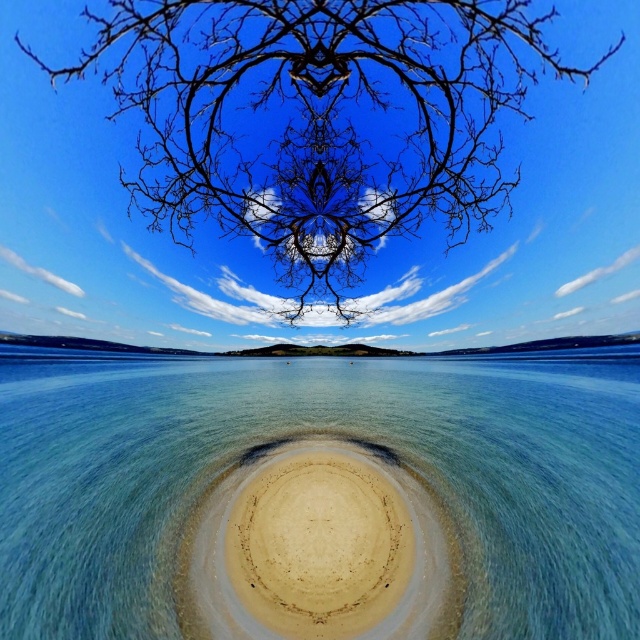
You are a bird trying to land on either the black matte tree at upper center or the beige sandy island at center. Which location offers a larger surface area for you to land safely?

The black matte tree at upper center might be wider than the beige sandy island at center, so it could provide a larger surface area for landing safely.

You are a bird flying over the surreal scene described. You want to land on the highest point available. Which object should you choose between the black matte tree at upper center and the beige sandy island at center?

The black matte tree at upper center has a greater height compared to the beige sandy island at center, so you should land on the black matte tree at upper center.

You are a painter trying to capture this scene. You want to ensure the clear water at center and the black matte tree at upper center are proportionally accurate. Which object should you focus on first to maintain the scene symmetry?

The clear water at center should be focused on first because it is wider than the black matte tree at upper center, so its dimensions will set the base for the symmetrical composition.